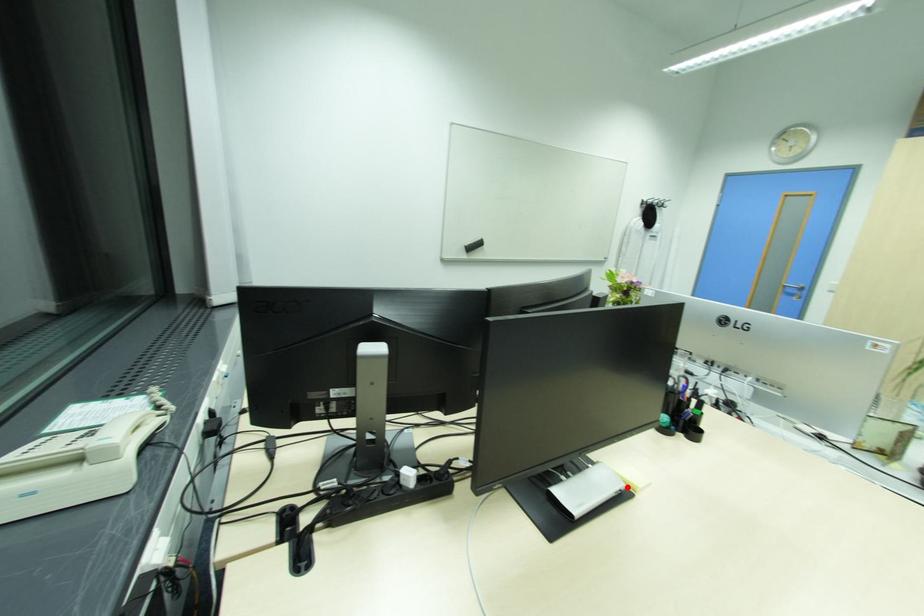
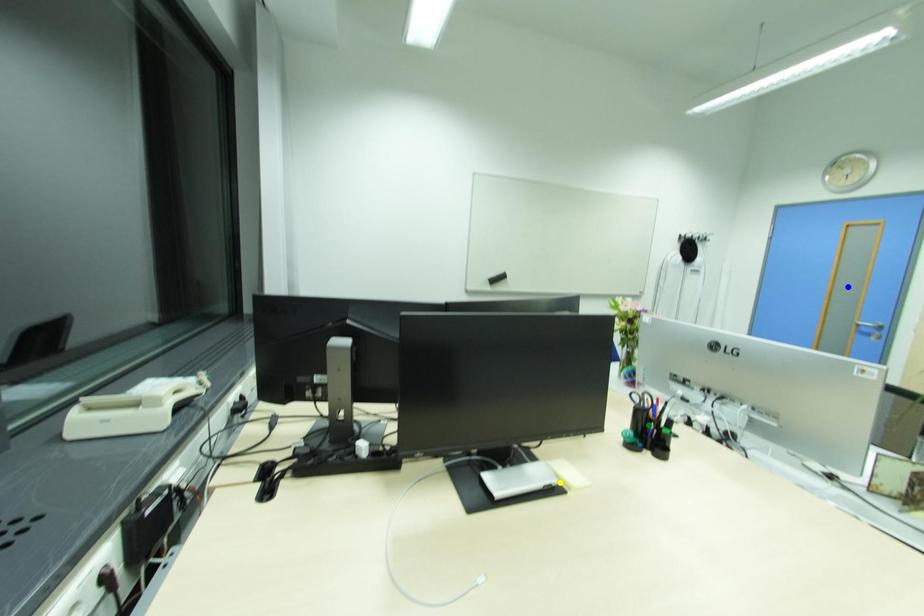
Question: I am providing you with two images of the same scene from different viewpoints. A red point is marked on the first image. You are given multiple points on the second image. Which point in image 2 is actually the same real-world point as the red point in image 1?

Choices:
 (A) blue point
 (B) green point
 (C) yellow point

Answer: (C)